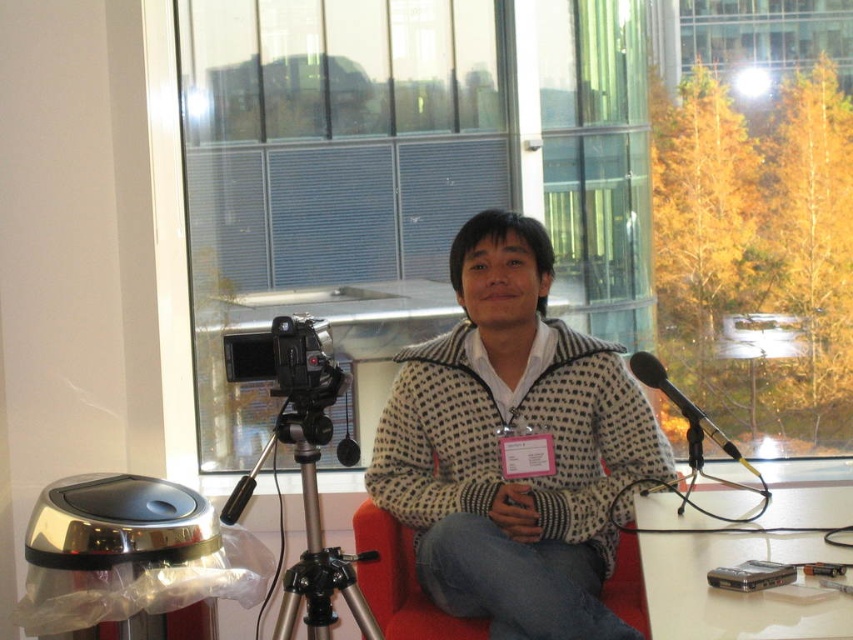
Question: Estimate the real-world distances between objects in this image. Which object is closer to the silver metallic tripod at lower left?

Choices:
 (A) metallic silver microphone at right
 (B) red fabric armchair at center

Answer: (B)

Question: Can you confirm if silver metallic tripod at lower left is wider than metallic silver microphone at right?

Choices:
 (A) no
 (B) yes

Answer: (B)

Question: Among these points, which one is nearest to the camera?

Choices:
 (A) (335, 557)
 (B) (374, 570)
 (C) (592, 433)

Answer: (A)

Question: Which object appears farthest from the camera in this image?

Choices:
 (A) red fabric armchair at center
 (B) checkered sweater at center
 (C) metallic silver microphone at right
 (D) silver metallic tripod at lower left

Answer: (A)

Question: Can you confirm if checkered sweater at center is positioned below red fabric armchair at center?

Choices:
 (A) no
 (B) yes

Answer: (A)

Question: Is silver metallic tripod at lower left in front of metallic silver microphone at right?

Choices:
 (A) no
 (B) yes

Answer: (B)